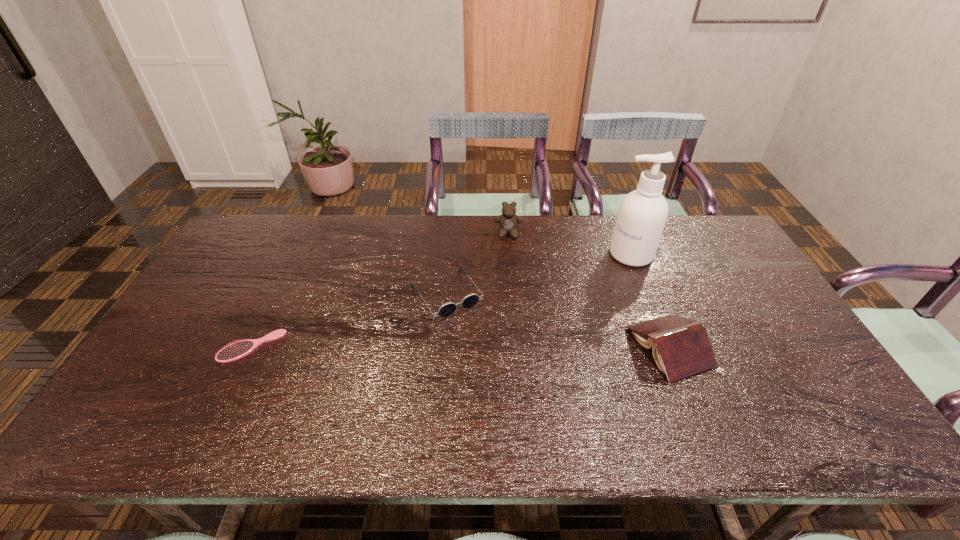
The width and height of the screenshot is (960, 540). I want to click on vacant region between the third object from right to left and the third tallest object, so click(588, 291).

In order to click on vacant area that lies between the third shortest object and the second shortest object in this screenshot , I will do `click(558, 321)`.

You are a GUI agent. You are given a task and a screenshot of the screen. Output one action in this format:
    pyautogui.click(x=<x>, y=<y>)
    Task: Click on the vacant space in between the third tallest object and the cleansing agent
    Image resolution: width=960 pixels, height=540 pixels.
    Given the screenshot: What is the action you would take?
    pyautogui.click(x=650, y=301)

Image resolution: width=960 pixels, height=540 pixels. What are the coordinates of `blank region between the second tallest object and the second shortest object` in the screenshot? It's located at (477, 265).

I want to click on free space between the cleansing agent and the book, so click(x=650, y=301).

I want to click on free spot between the book and the third object from right to left, so click(588, 291).

Locate an element on the screen. Image resolution: width=960 pixels, height=540 pixels. empty space between the book and the shortest object is located at coordinates (461, 347).

At what (x,y) coordinates should I click in order to perform the action: click on empty space that is in between the cleansing agent and the farthest object. Please return your answer as a coordinate pair (x, y). The width and height of the screenshot is (960, 540). Looking at the image, I should click on (569, 244).

The width and height of the screenshot is (960, 540). I want to click on free point between the shortest object and the tallest object, so (x=442, y=301).

Point out which object is positioned as the nearest to the second tallest object. Please provide its 2D coordinates. Your answer should be formatted as a tuple, i.e. [(x, y)], where the tuple contains the x and y coordinates of a point satisfying the conditions above.

[(470, 300)]